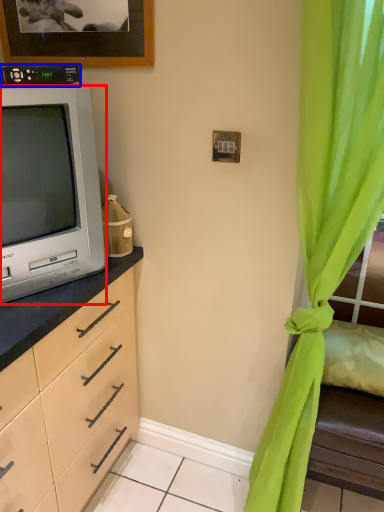
Question: Among these objects, which one is farthest to the camera, television (highlighted by a red box) or appliance (highlighted by a blue box)?

Choices:
 (A) television
 (B) appliance

Answer: (B)